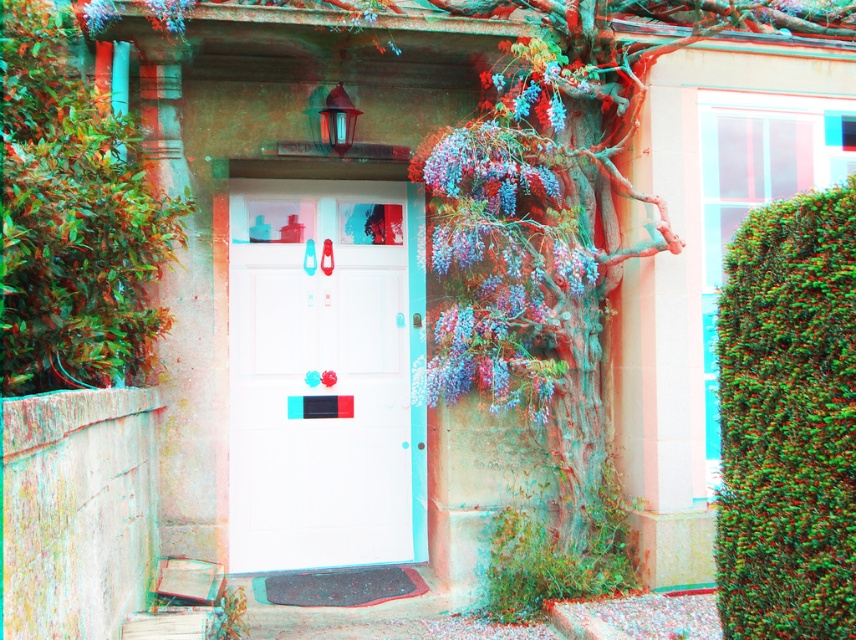
Question: Which point is closer to the camera taking this photo?

Choices:
 (A) (129, 227)
 (B) (313, 204)

Answer: (A)

Question: Which of these objects is positioned farthest from the green textured hedge at right?

Choices:
 (A) white glossy door at center
 (B) green leafy bush at left

Answer: (A)

Question: Does white glossy door at center appear under green leafy bush at left?

Choices:
 (A) yes
 (B) no

Answer: (A)

Question: Which object is closer to the camera taking this photo?

Choices:
 (A) green textured hedge at right
 (B) white glossy door at center

Answer: (A)

Question: Can you confirm if green textured hedge at right is positioned above green leafy bush at left?

Choices:
 (A) yes
 (B) no

Answer: (B)

Question: Can you confirm if white glossy door at center is smaller than green leafy bush at left?

Choices:
 (A) yes
 (B) no

Answer: (A)